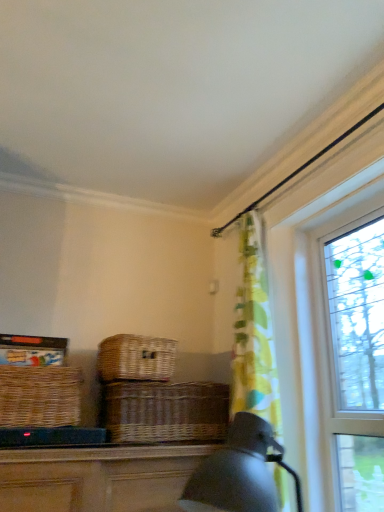
Question: Which is correct: brown wicker basket at center is inside clear glass window at right, or outside of it?

Choices:
 (A) outside
 (B) inside

Answer: (A)

Question: Is brown wicker basket at center bigger or smaller than clear glass window at right?

Choices:
 (A) big
 (B) small

Answer: (B)

Question: Based on their relative distances, which object is farther from the clear glass window at right?

Choices:
 (A) woven brown picnic basket at center, acting as the second picnic basket starting from the left
 (B) woven brown picnic basket at left, which ranks as the second picnic basket in right-to-left order
 (C) brown wicker basket at center

Answer: (B)

Question: Considering the real-world distances, which object is farthest from the clear glass window at right?

Choices:
 (A) brown wicker basket at center
 (B) woven brown picnic basket at left, which ranks as the second picnic basket in right-to-left order
 (C) woven brown picnic basket at center, acting as the second picnic basket starting from the left

Answer: (B)